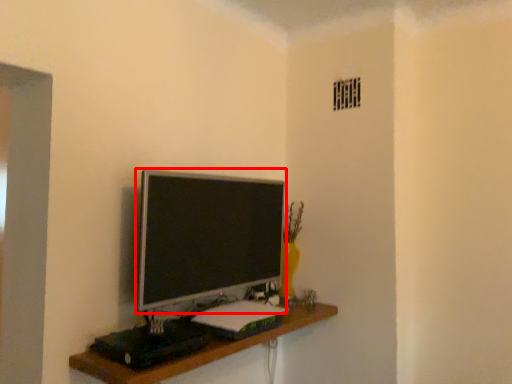
Question: Considering the relative positions of television (annotated by the red box) and shelf in the image provided, where is television (annotated by the red box) located with respect to the staircase?

Choices:
 (A) right
 (B) left

Answer: (B)